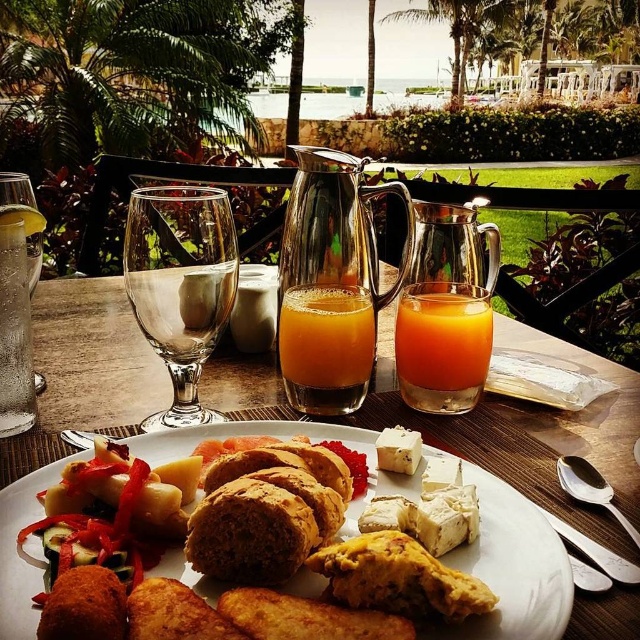
Based on the photo, you are a server at the resort and need to place a new menu on the table. The menu is 20 centimeters wide. Can you fit it between the orange liquid at center and the silver spoon at upper right without moving either item?

The distance between the orange liquid at center and the silver spoon at upper right is 17.54 centimeters. Since the menu is 20 centimeters wide, it cannot fit in the space between them without moving either item.

You are a server at the resort and need to place a napkin between the translucent glass orange juice at center and the satin silver spoon at lower right. The napkin is 3.5 inches wide. Will it fit without overlapping either item?

The distance between the translucent glass orange juice at center and the satin silver spoon at lower right is 4.10 inches. Since the napkin is 3.5 inches wide, it can be placed between them without overlapping, leaving 0.6 inches of space on either side.

You are a guest at the resort and want to pour the orange liquid at center into the silver spoon at upper right. Is the liquid likely to overflow when you pour it into the spoon?

The orange liquid at center has a greater height compared to silver spoon at upper right, so pouring the liquid into the spoon may cause it to overflow since the spoon is smaller in height.